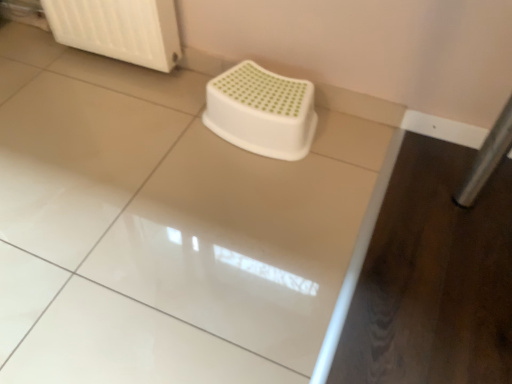
The height and width of the screenshot is (384, 512). Describe the element at coordinates (162, 227) in the screenshot. I see `white glossy counter top at center` at that location.

Where is `white plastic radiator at upper left`? The width and height of the screenshot is (512, 384). white plastic radiator at upper left is located at coordinates (118, 29).

In the scene shown: From the image's perspective, is white glossy counter top at center over white plastic radiator at upper left?

Actually, white glossy counter top at center appears below white plastic radiator at upper left in the image.

Considering the sizes of white glossy counter top at center and white plastic radiator at upper left in the image, is white glossy counter top at center taller or shorter than white plastic radiator at upper left?

Considering their sizes, white glossy counter top at center has less height than white plastic radiator at upper left.

Looking at this image, does white glossy counter top at center touch white plastic radiator at upper left?

No, white glossy counter top at center is not with white plastic radiator at upper left.

Considering their positions, is white plastic radiator at upper left located in front of or behind white glossy counter top at center?

white plastic radiator at upper left is behind white glossy counter top at center.

Between white plastic radiator at upper left and white glossy counter top at center, which one has more height?

white plastic radiator at upper left.

Considering the positions of point (122, 27) and point (82, 152), is point (122, 27) closer or farther from the camera than point (82, 152)?

Clearly, point (122, 27) is more distant from the camera than point (82, 152).

Can you see white plastic radiator at upper left touching white glossy counter top at center?

white plastic radiator at upper left and white glossy counter top at center are not in contact.

Between white plastic radiator at upper left and white plastic stool at center, which one appears on the right side from the viewer's perspective?

Positioned to the right is white plastic stool at center.

From a real-world perspective, is white plastic radiator at upper left physically above white plastic stool at center?

Yes.

From the image's perspective, is white plastic radiator at upper left located beneath white plastic stool at center?

Incorrect, from the image's perspective, white plastic radiator at upper left is higher than white plastic stool at center.

The image size is (512, 384). What are the coordinates of `counter top in front of the white plastic stool at center` in the screenshot? It's located at (162, 227).

From a real-world perspective, between white plastic stool at center and white glossy counter top at center, who is vertically higher?

white plastic stool at center is physically above.

Who is shorter, white plastic stool at center or white glossy counter top at center?

white glossy counter top at center.

Considering the positions of objects white plastic stool at center and white glossy counter top at center in the image provided, who is more to the right, white plastic stool at center or white glossy counter top at center?

white plastic stool at center.

Between white glossy counter top at center and white plastic stool at center, which one has less height?

white glossy counter top at center.

From a real-world perspective, is white glossy counter top at center located higher than white plastic stool at center?

No, from a real-world perspective, white glossy counter top at center is not on top of white plastic stool at center.

From the picture: From the image's perspective, does white glossy counter top at center appear lower than white plastic stool at center?

Yes.

Is point (257, 65) closer or farther from the camera than point (141, 18)?

Point (257, 65) is farther from the camera than point (141, 18).

Is white plastic stool at center next to white plastic radiator at upper left and touching it?

No, white plastic stool at center is not next to white plastic radiator at upper left.

From a real-world perspective, is white plastic stool at center on white plastic radiator at upper left?

Incorrect, from a real-world perspective, white plastic stool at center is lower than white plastic radiator at upper left.

Is white plastic stool at center at the right side of white plastic radiator at upper left?

Yes, white plastic stool at center is to the right of white plastic radiator at upper left.

Locate an element on the screen. radiator behind the white glossy counter top at center is located at coordinates pos(118,29).

The width and height of the screenshot is (512, 384). Find the location of `radiator to the left of white glossy counter top at center`. radiator to the left of white glossy counter top at center is located at coordinates (118, 29).

Based on their spatial positions, is white plastic radiator at upper left or white glossy counter top at center further from white plastic stool at center?

white plastic radiator at upper left.

From the image, which object appears to be nearer to white glossy counter top at center, white plastic radiator at upper left or white plastic stool at center?

white plastic stool at center is positioned closer to the anchor white glossy counter top at center.

Which object lies nearer to the anchor point white plastic stool at center, white glossy counter top at center or white plastic radiator at upper left?

Based on the image, white glossy counter top at center appears to be nearer to white plastic stool at center.

From the image, which object appears to be farther from white plastic radiator at upper left, white plastic stool at center or white glossy counter top at center?

white glossy counter top at center is positioned further to the anchor white plastic radiator at upper left.

From the image, which object appears to be nearer to white glossy counter top at center, white plastic stool at center or white plastic radiator at upper left?

Among the two, white plastic stool at center is located nearer to white glossy counter top at center.

When comparing their distances from white plastic radiator at upper left, does white glossy counter top at center or white plastic stool at center seem further?

Among the two, white glossy counter top at center is located further to white plastic radiator at upper left.

In order to click on toilet between white glossy counter top at center and white plastic radiator at upper left in the front-back direction in this screenshot , I will do `click(262, 111)`.